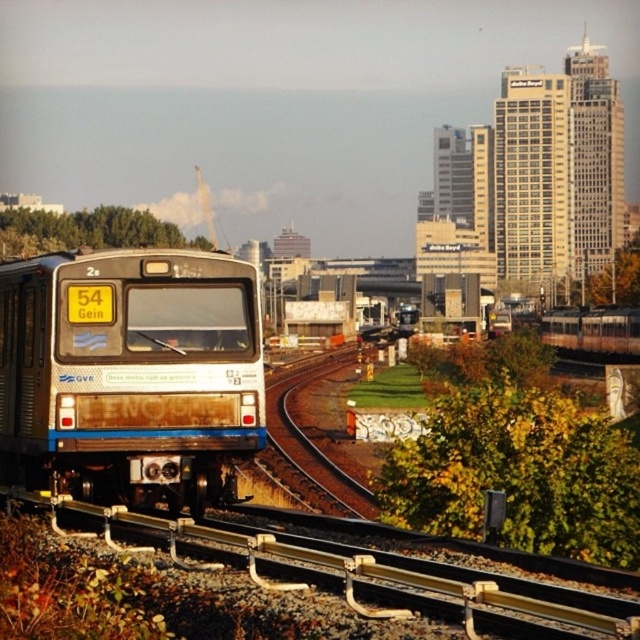
Does point (13, 394) come in front of point (522, 612)?

No.

Between point (54, 252) and point (381, 564), which one is positioned in front?

Point (381, 564) is more forward.

Where is `rusty metal train at center`? The image size is (640, 640). rusty metal train at center is located at coordinates (129, 374).

Where is `rusty metal train at center`? The width and height of the screenshot is (640, 640). rusty metal train at center is located at coordinates (129, 374).